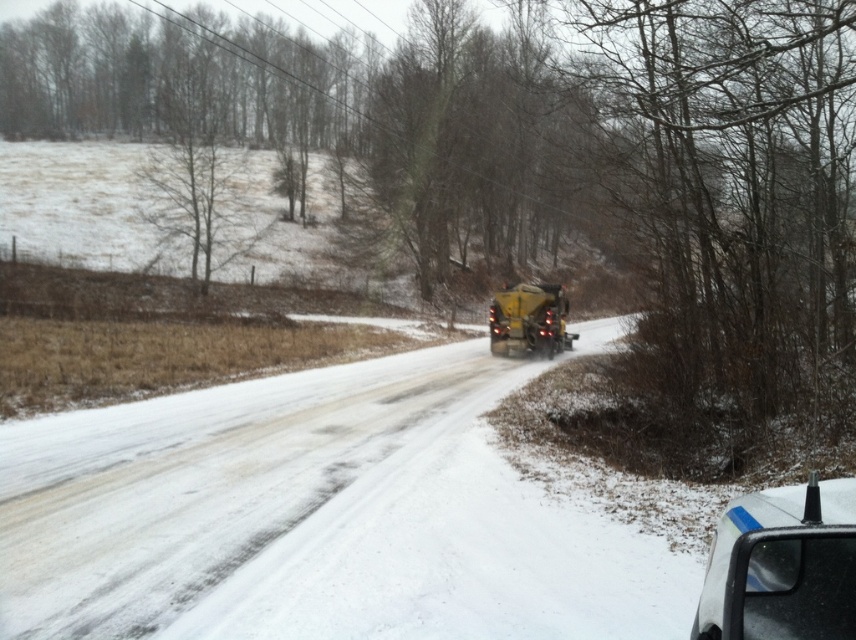
Image resolution: width=856 pixels, height=640 pixels. What do you see at coordinates (782, 564) in the screenshot?
I see `black glossy car at lower right` at bounding box center [782, 564].

Does point (812, 564) come behind point (504, 332)?

That is False.

Is point (795, 618) closer to viewer compared to point (521, 289)?

Yes, it is in front of point (521, 289).

The image size is (856, 640). What are the coordinates of `black glossy car at lower right` in the screenshot? It's located at (782, 564).